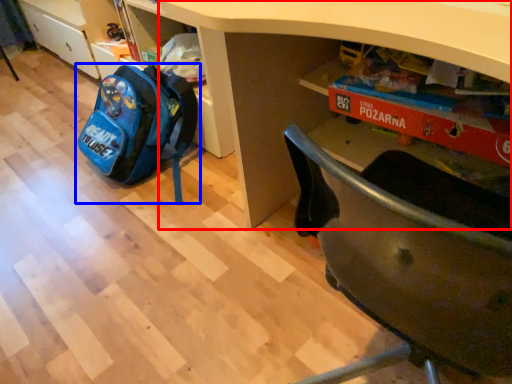
Question: Which object is further to the camera taking this photo, desk (highlighted by a red box) or backpack (highlighted by a blue box)?

Choices:
 (A) desk
 (B) backpack

Answer: (B)